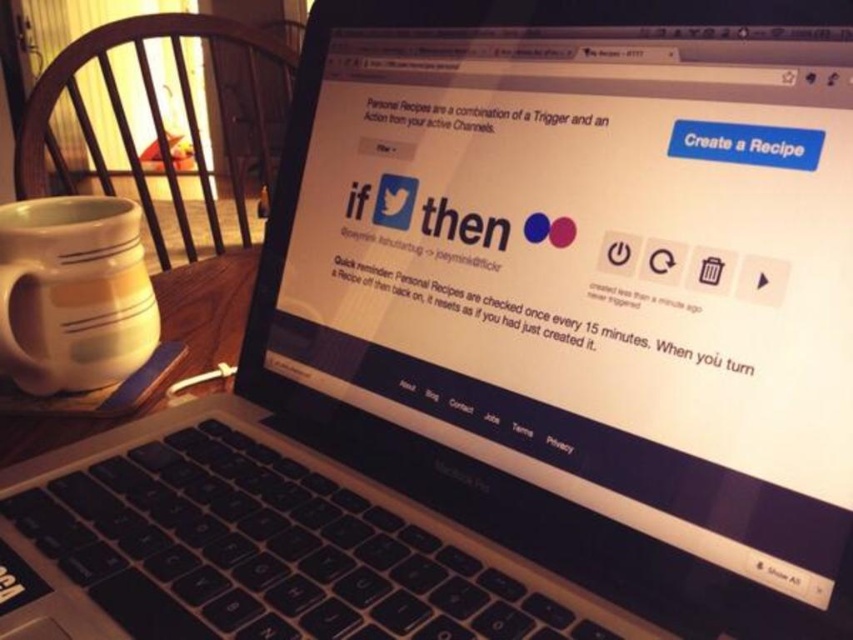
Question: Which of the following is the closest to the observer?

Choices:
 (A) (134, 324)
 (B) (163, 285)

Answer: (A)

Question: From the image, what is the correct spatial relationship of white matte mug at left in relation to white ceramic table at lower left?

Choices:
 (A) right
 (B) left

Answer: (B)

Question: Does white matte mug at left have a larger size compared to white ceramic table at lower left?

Choices:
 (A) yes
 (B) no

Answer: (B)

Question: Is the position of white matte mug at left less distant than that of white ceramic table at lower left?

Choices:
 (A) no
 (B) yes

Answer: (B)

Question: Which of the following is the farthest from the observer?

Choices:
 (A) (70, 284)
 (B) (212, 298)

Answer: (B)